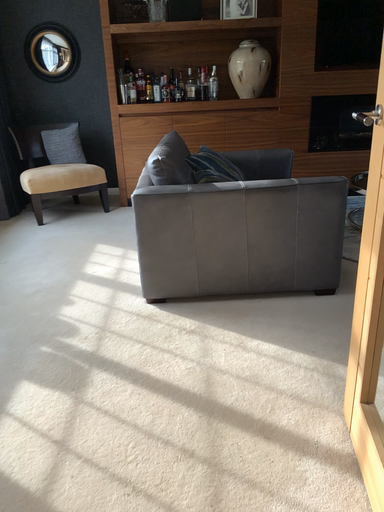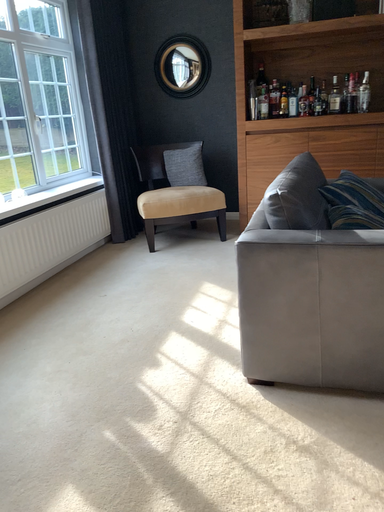
Question: Which way did the camera rotate in the video?

Choices:
 (A) rotated left
 (B) rotated right

Answer: (A)